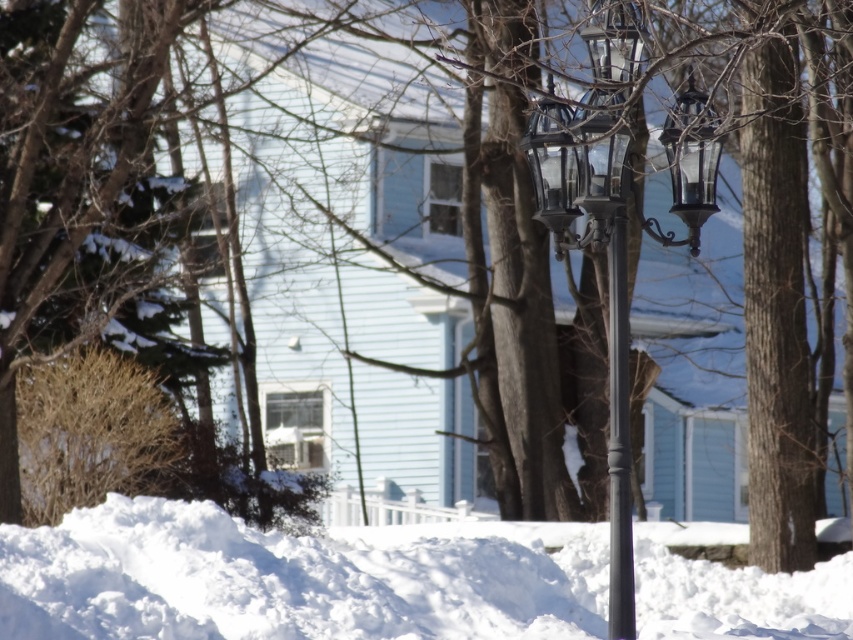
Question: Can you confirm if white fluffy snow at lower center is thinner than glossy metal lamp post at center?

Choices:
 (A) no
 (B) yes

Answer: (A)

Question: Can you confirm if white fluffy snow at lower center is wider than glossy metal lamp post at center?

Choices:
 (A) yes
 (B) no

Answer: (A)

Question: Is white fluffy snow at lower center smaller than glossy metal lamp post at center?

Choices:
 (A) no
 (B) yes

Answer: (A)

Question: Which point appears closest to the camera in this image?

Choices:
 (A) (585, 36)
 (B) (41, 552)

Answer: (A)